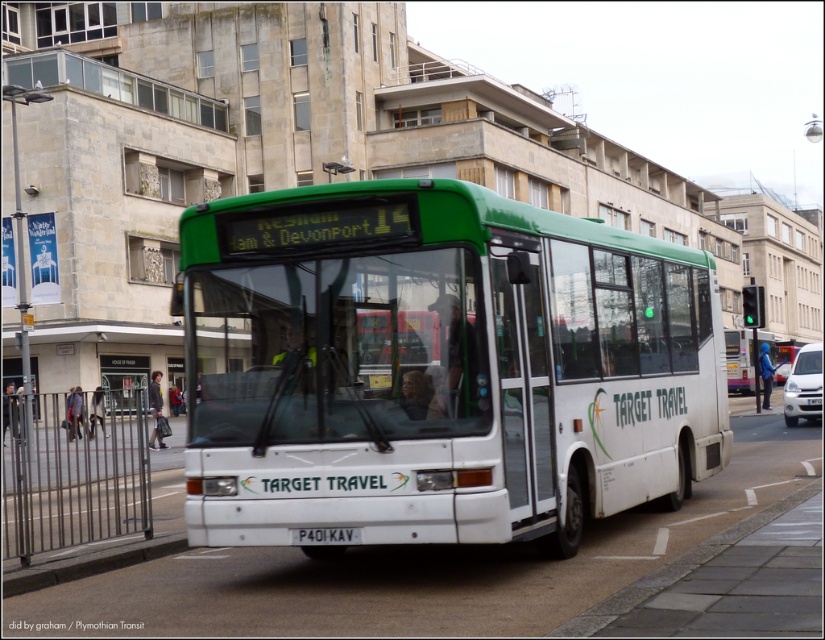
Is white matte bus at center in front of black plastic license plate at center?

Yes.

Does white matte bus at center lie behind black plastic license plate at center?

No, white matte bus at center is closer to the viewer.

At what (x,y) coordinates should I click in order to perform the action: click on white matte bus at center. Please return your answer as a coordinate pair (x, y). The height and width of the screenshot is (640, 825). Looking at the image, I should click on (437, 365).

What are the coordinates of `white matte bus at center` in the screenshot? It's located at (437, 365).